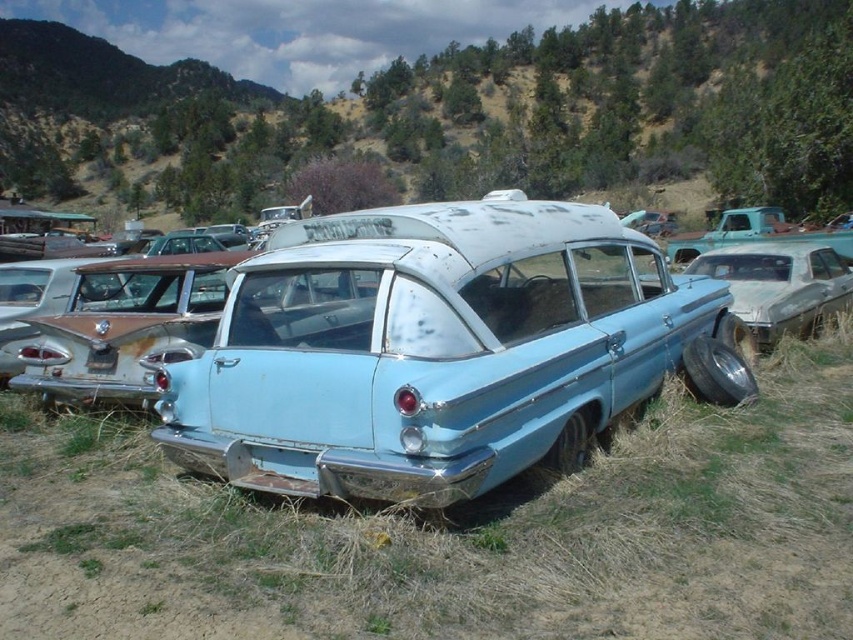
You are standing in a junkyard and want to take a photo of the light blue metallic station wagon at center and the green grassy hillside at upper center. Which object is positioned to the left of the other?

The green grassy hillside at upper center is to the left of the light blue metallic station wagon at center.

You are a photographer trying to capture a clear shot of both the light blue metallic station wagon at center and the rusty metal station wagon at center. Since you want both cars to be fully visible in your photo, would positioning the camera at a higher angle help achieve this?

The light blue metallic station wagon at center is much taller than the rusty metal station wagon at center. Positioning the camera at a higher angle might help ensure both cars are fully visible, as the taller light blue car could block parts of the shorter rusty one if shot from lower angles.